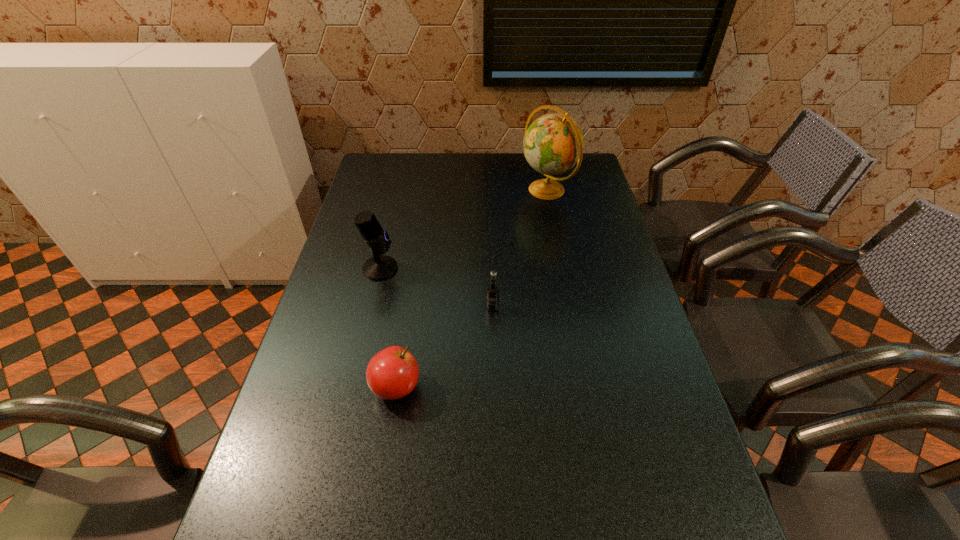
Find the location of a particular element. Image resolution: width=960 pixels, height=540 pixels. free spot located on the label of the root beer is located at coordinates (495, 406).

At what (x,y) coordinates should I click in order to perform the action: click on free space located 0.300m on the right of the shortest object. Please return your answer as a coordinate pair (x, y). This screenshot has height=540, width=960. Looking at the image, I should click on (545, 387).

The width and height of the screenshot is (960, 540). Find the location of `object that is at the far edge`. object that is at the far edge is located at coordinates (553, 144).

The height and width of the screenshot is (540, 960). In order to click on object located at the left edge in this screenshot , I will do `click(380, 267)`.

The width and height of the screenshot is (960, 540). Find the location of `object that is positioned at the right edge`. object that is positioned at the right edge is located at coordinates (553, 144).

Locate an element on the screen. The height and width of the screenshot is (540, 960). object present at the far right corner is located at coordinates pos(553,144).

At what (x,y) coordinates should I click in order to perform the action: click on free space at the left edge of the desktop. Please return your answer as a coordinate pair (x, y). Looking at the image, I should click on (316, 329).

This screenshot has width=960, height=540. In the image, there is a desktop. Find the location of `vacant space at the right edge`. vacant space at the right edge is located at coordinates (582, 271).

This screenshot has width=960, height=540. Find the location of `free spot at the far left corner of the desktop`. free spot at the far left corner of the desktop is located at coordinates (377, 183).

In the image, there is a desktop. Where is `vacant area at the far right corner`? This screenshot has width=960, height=540. vacant area at the far right corner is located at coordinates (584, 179).